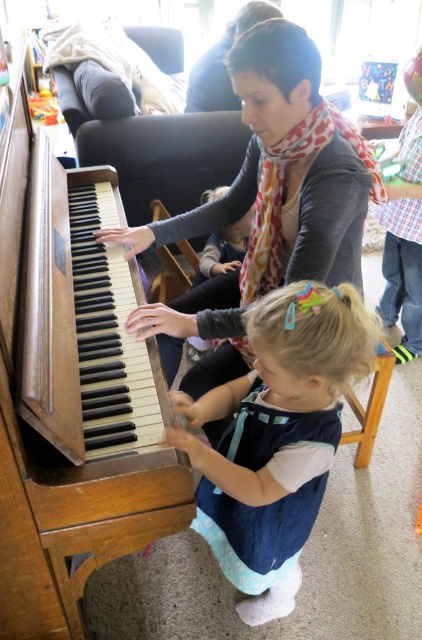
You are a photographer setting up for a family portrait. You need to position a tripod between the wooden stool at lower center and the light blue denim dress at center. Based on the scene description, where should the tripod be placed?

The wooden stool at lower center is located below the light blue denim dress at center, so the tripod should be placed between them, below the light blue denim dress at center and above the wooden stool at lower center.

You are a photographer setting up for a family portrait. The wooden piano at left and the matte gray sweater at center are in your viewfinder. Based on their positions, which object should you adjust your camera angle to focus on first if you want to include both in the frame without moving the subjects?

The wooden piano at left is below the matte gray sweater at center, so you should adjust your camera angle to focus on the wooden piano at left first to ensure both objects are in the frame.

You are a photographer setting up for a family photo. You need to position a tripod between the wooden piano at left and the light blue denim dress at center. Considering their widths, which object requires more space on the side where you are placing the tripod?

The wooden piano at left requires more space on the side where you are placing the tripod because its width surpasses that of the light blue denim dress at center.